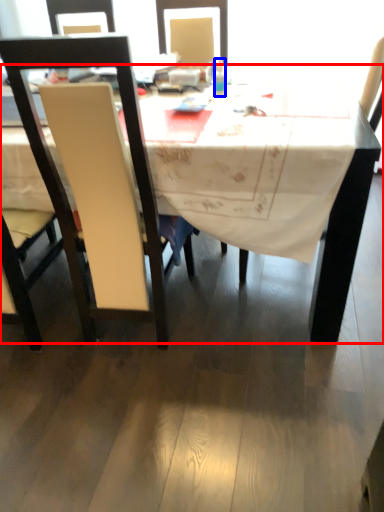
Question: Which object is further to the camera taking this photo, desk (highlighted by a red box) or bottle (highlighted by a blue box)?

Choices:
 (A) desk
 (B) bottle

Answer: (B)